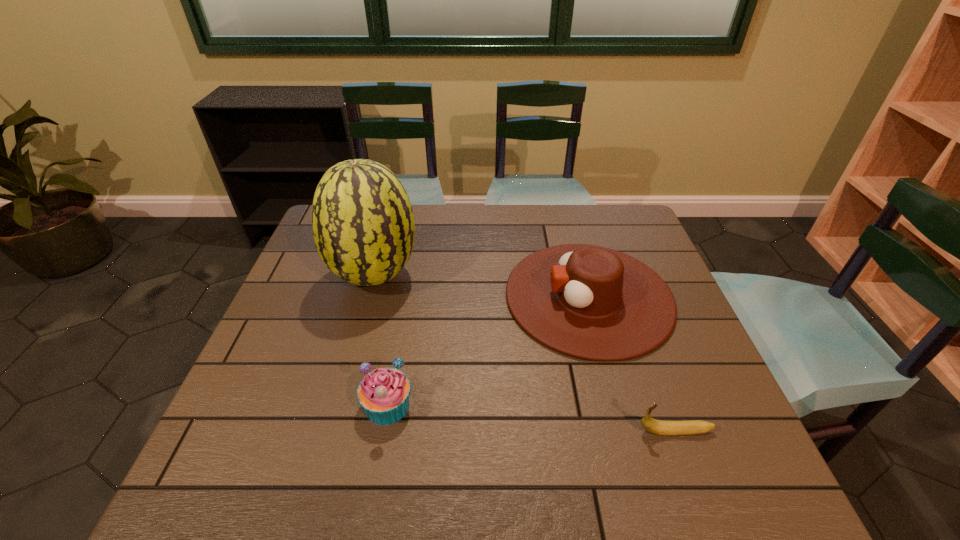
Locate an element on the screen. This screenshot has width=960, height=540. free spot between the cowboy hat and the shortest object is located at coordinates (632, 364).

Locate which object is the second closest to the tallest object. Please provide its 2D coordinates. Your answer should be formatted as a tuple, i.e. [(x, y)], where the tuple contains the x and y coordinates of a point satisfying the conditions above.

[(590, 302)]

Identify which object is the third nearest to the banana. Please provide its 2D coordinates. Your answer should be formatted as a tuple, i.e. [(x, y)], where the tuple contains the x and y coordinates of a point satisfying the conditions above.

[(363, 226)]

At what (x,y) coordinates should I click in order to perform the action: click on free space that satisfies the following two spatial constraints: 1. on the front side of the muffin; 2. on the left side of the watermelon. Please return your answer as a coordinate pair (x, y). Looking at the image, I should click on (340, 405).

Identify the location of vacant space that satisfies the following two spatial constraints: 1. on the front-facing side of the cowboy hat; 2. on the front side of the muffin. Image resolution: width=960 pixels, height=540 pixels. (617, 405).